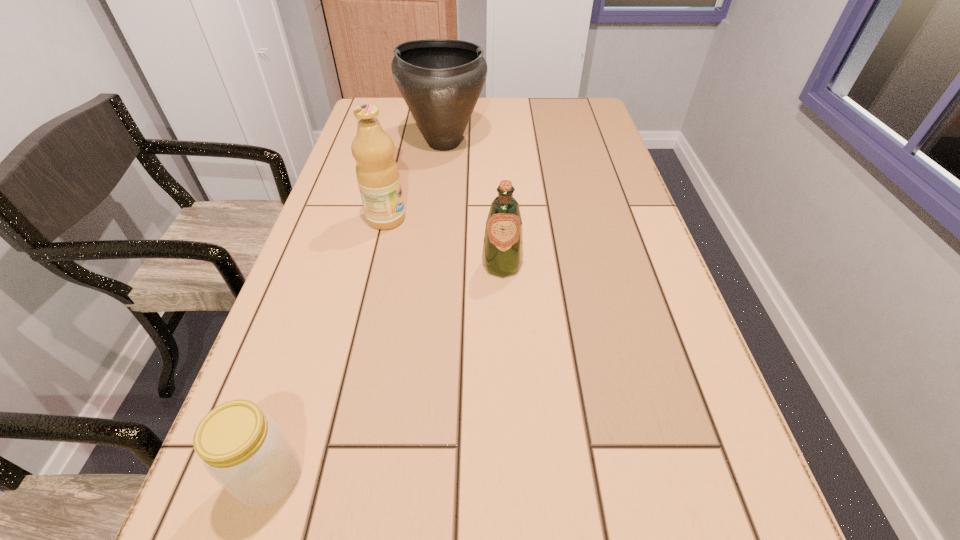
Find the location of a particular element. The height and width of the screenshot is (540, 960). the second farthest object is located at coordinates (377, 173).

Locate an element on the screen. The height and width of the screenshot is (540, 960). the farther olive oil is located at coordinates (377, 173).

Find the location of a particular element. urn is located at coordinates point(440,80).

You are a GUI agent. You are given a task and a screenshot of the screen. Output one action in this format:
    pyautogui.click(x=<x>, y=<y>)
    Task: Click on the third tallest object
    The image size is (960, 540).
    Given the screenshot: What is the action you would take?
    pyautogui.click(x=502, y=255)

Find the location of a particular element. The image size is (960, 540). the nearer olive oil is located at coordinates coord(502,255).

Where is `the shortest object`? The height and width of the screenshot is (540, 960). the shortest object is located at coordinates (243, 449).

Identify the location of the nearest object. (243, 449).

The width and height of the screenshot is (960, 540). In order to click on free space located 0.310m on the label of the farther olive oil in this screenshot , I will do `click(537, 219)`.

Find the location of `free space located 0.160m on the left of the farthest object`. free space located 0.160m on the left of the farthest object is located at coordinates (348, 143).

Locate an element on the screen. The width and height of the screenshot is (960, 540). vacant space positioned 0.390m on the front-facing side of the third tallest object is located at coordinates (513, 474).